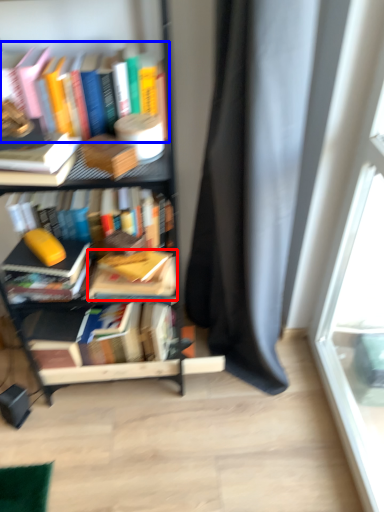
Question: Among these objects, which one is farthest to the camera, book (highlighted by a red box) or book (highlighted by a blue box)?

Choices:
 (A) book
 (B) book

Answer: (A)